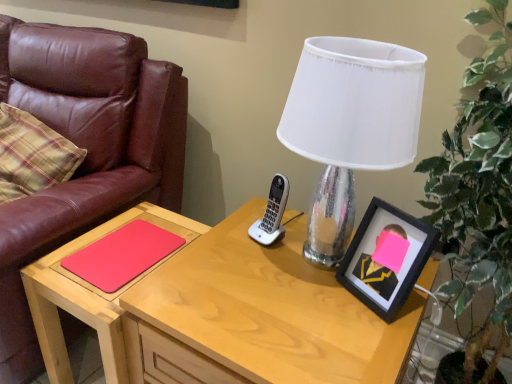
Question: Is matte wood table at lower left shorter than green leafy plant at right?

Choices:
 (A) no
 (B) yes

Answer: (B)

Question: Can you see matte wood table at lower left touching green leafy plant at right?

Choices:
 (A) yes
 (B) no

Answer: (B)

Question: From the image's perspective, does matte wood table at lower left appear lower than green leafy plant at right?

Choices:
 (A) yes
 (B) no

Answer: (A)

Question: Would you say matte wood table at lower left is outside green leafy plant at right?

Choices:
 (A) no
 (B) yes

Answer: (B)

Question: From a real-world perspective, does matte wood table at lower left sit lower than green leafy plant at right?

Choices:
 (A) yes
 (B) no

Answer: (A)

Question: Is matte brown leather chair at left in front of or behind black matte picture frame at right in the image?

Choices:
 (A) front
 (B) behind

Answer: (A)

Question: Is point (9, 23) positioned closer to the camera than point (400, 266)?

Choices:
 (A) closer
 (B) farther

Answer: (B)

Question: In terms of height, does matte brown leather chair at left look taller or shorter compared to black matte picture frame at right?

Choices:
 (A) tall
 (B) short

Answer: (A)

Question: Would you say matte brown leather chair at left is to the left or to the right of black matte picture frame at right in the picture?

Choices:
 (A) right
 (B) left

Answer: (B)

Question: From the image's perspective, relative to black matte picture frame at right, is matte wood desk at center above or below?

Choices:
 (A) below
 (B) above

Answer: (A)

Question: Does point (274, 259) appear closer or farther from the camera than point (378, 256)?

Choices:
 (A) farther
 (B) closer

Answer: (A)

Question: Considering the positions of matte wood desk at center and black matte picture frame at right in the image, is matte wood desk at center bigger or smaller than black matte picture frame at right?

Choices:
 (A) big
 (B) small

Answer: (A)

Question: Relative to black matte picture frame at right, is matte wood desk at center in front or behind?

Choices:
 (A) front
 (B) behind

Answer: (A)

Question: Is point (347, 241) positioned closer to the camera than point (116, 261)?

Choices:
 (A) closer
 (B) farther

Answer: (A)

Question: In terms of size, does clear glass lamp at center appear bigger or smaller than rubberized matte red notepad at lower left?

Choices:
 (A) small
 (B) big

Answer: (B)